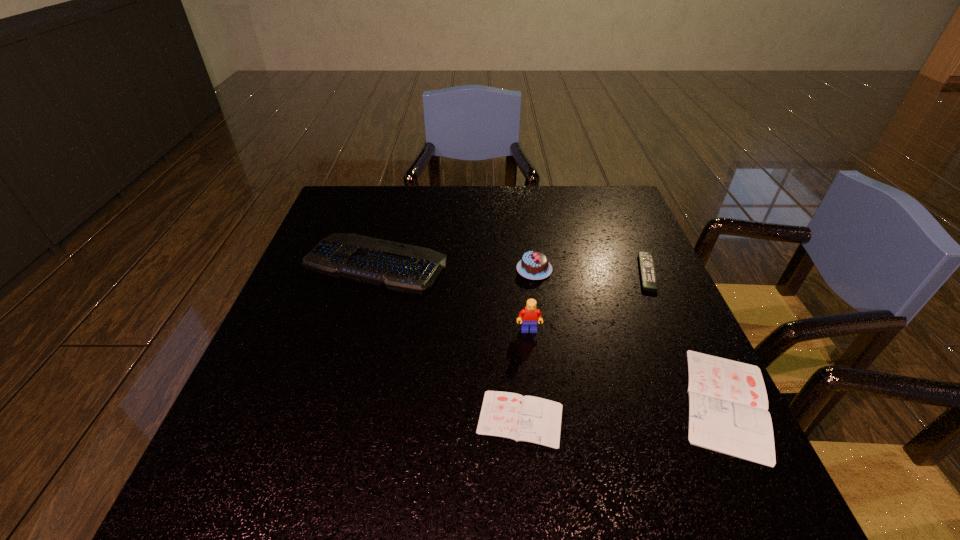
This screenshot has width=960, height=540. In order to click on vacant point located between the left diary and the second tallest object in this screenshot , I will do `click(527, 344)`.

Where is `free space between the computer keyboard and the remote control`? Image resolution: width=960 pixels, height=540 pixels. free space between the computer keyboard and the remote control is located at coordinates (511, 268).

The width and height of the screenshot is (960, 540). What are the coordinates of `empty space that is in between the chocolate cake and the taller diary` in the screenshot? It's located at (630, 336).

Locate an element on the screen. The height and width of the screenshot is (540, 960). vacant space that's between the chocolate cake and the taller diary is located at coordinates (630, 336).

What are the coordinates of `vacant area that lies between the computer keyboard and the right diary` in the screenshot? It's located at (551, 333).

The image size is (960, 540). I want to click on object that is the fourth closest to the shorter diary, so click(534, 265).

Locate an element on the screen. Image resolution: width=960 pixels, height=540 pixels. the third closest object relative to the right diary is located at coordinates (528, 317).

Locate an element on the screen. free location that satisfies the following two spatial constraints: 1. on the face of the taller diary; 2. on the right side of the fourth farthest object is located at coordinates (537, 402).

Where is `vacant space that satisfies the following two spatial constraints: 1. on the back side of the left diary; 2. on the left side of the right diary`? vacant space that satisfies the following two spatial constraints: 1. on the back side of the left diary; 2. on the left side of the right diary is located at coordinates (519, 402).